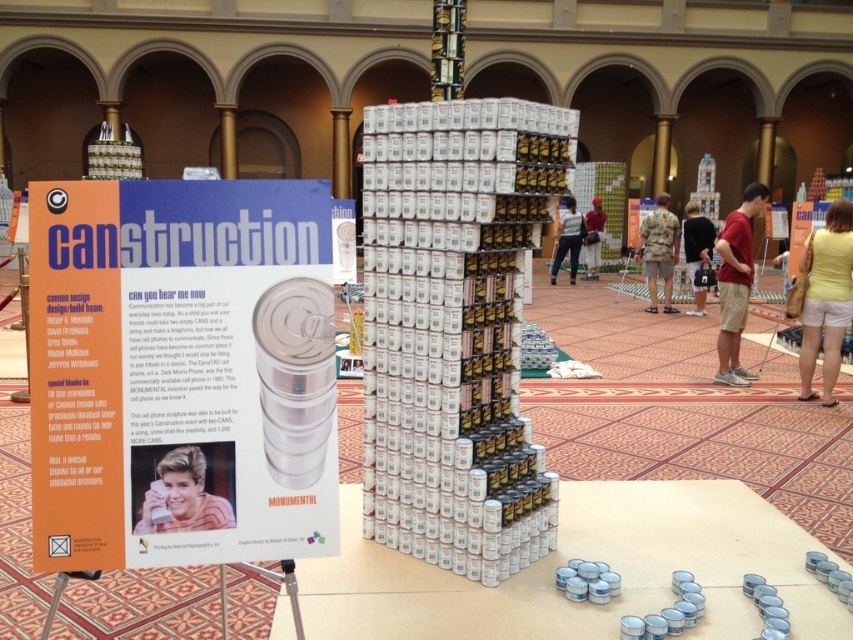
You are organizing a charity event and need to place a small donation box. You have two options for placement near the Canstruction display. The yellow cotton shorts at lower right and the camouflage fabric shorts at center. Which location has enough space for the donation box?

The camouflage fabric shorts at center is larger than the yellow cotton shorts at lower right, so the camouflage fabric shorts at center has enough space for the donation box.

You are at the Canstruction event and want to take a photo of the smooth plastic phone at center and the matte red shirt at center. Which object should you focus on first to ensure both are in clear view?

You should focus on the smooth plastic phone at center first since it is closer to you than the matte red shirt at center, ensuring both are in clear view when focused properly.